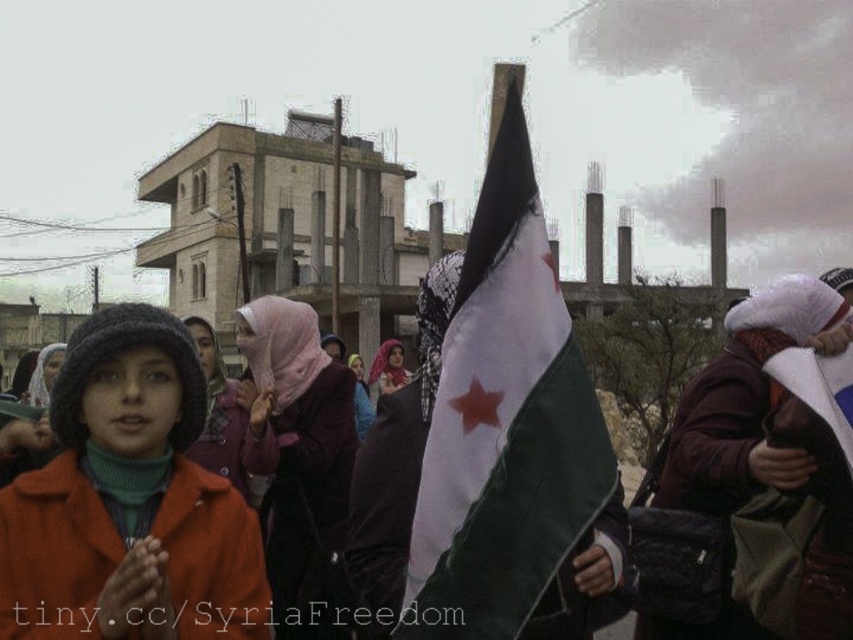
Question: Can you confirm if pink fabric headscarf at center is thinner than matte pink scarf at center?

Choices:
 (A) no
 (B) yes

Answer: (A)

Question: Which object appears farthest from the camera in this image?

Choices:
 (A) pink fabric headscarf at center
 (B) white fabric flag at center
 (C) matte pink scarf at center

Answer: (C)

Question: Which is nearer to the white fabric flag at center?

Choices:
 (A) pink fabric headscarf at center
 (B) matte pink scarf at center

Answer: (A)

Question: Does pink fabric headscarf at center appear under matte pink scarf at center?

Choices:
 (A) no
 (B) yes

Answer: (B)

Question: Which of the following is the closest to the observer?

Choices:
 (A) white fabric flag at center
 (B) pink fabric headscarf at center

Answer: (A)

Question: Is white fabric flag at center to the right of matte pink scarf at center from the viewer's perspective?

Choices:
 (A) no
 (B) yes

Answer: (B)